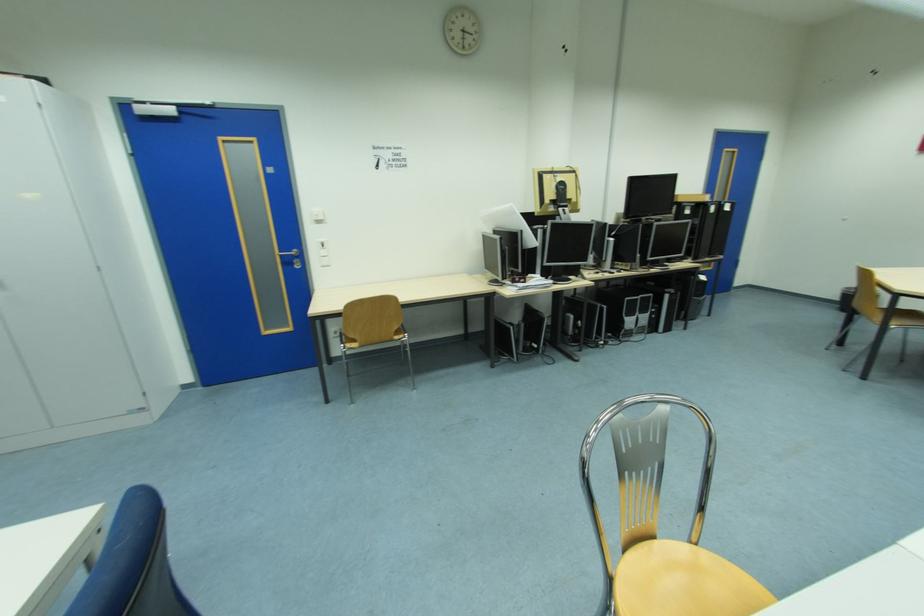
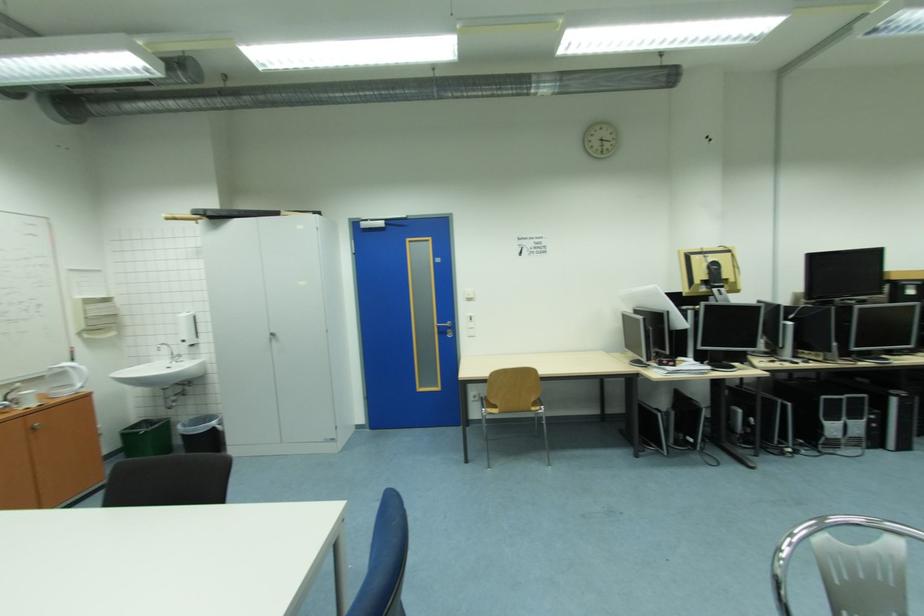
The point at (517, 330) is marked in the first image. Where is the corresponding point in the second image?

(663, 416)